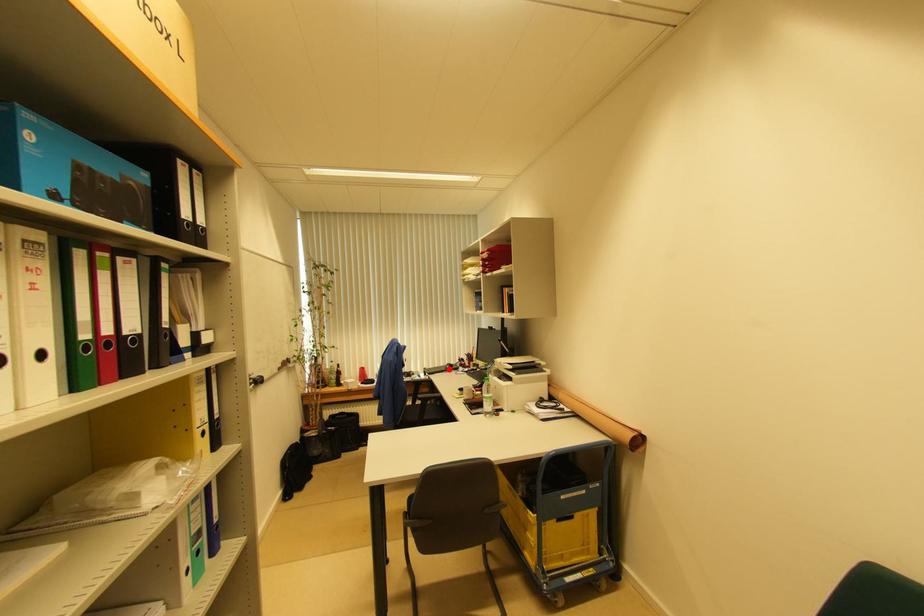
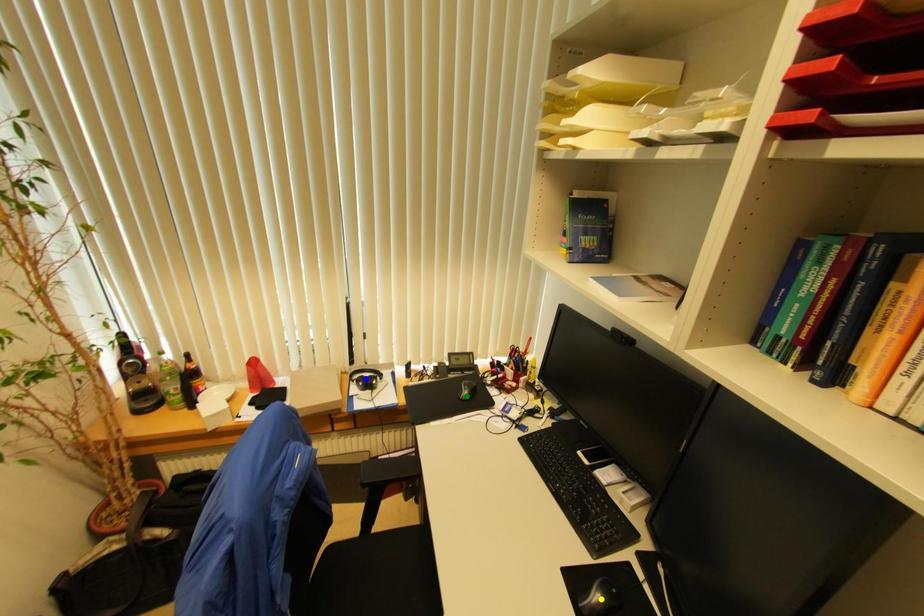
Question: I am providing you with two images of the same scene from different viewpoints. A red point is marked on the first image. You are given multiple points on the second image. Which point in image 2 represents the same 3d spot as the red point in image 1?

Choices:
 (A) blue point
 (B) green point
 (C) yellow point

Answer: (B)